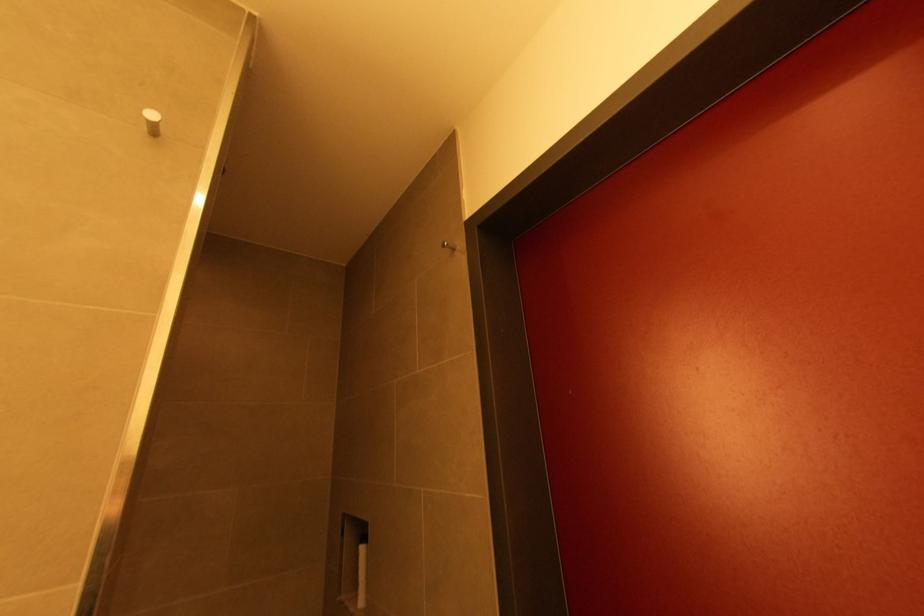
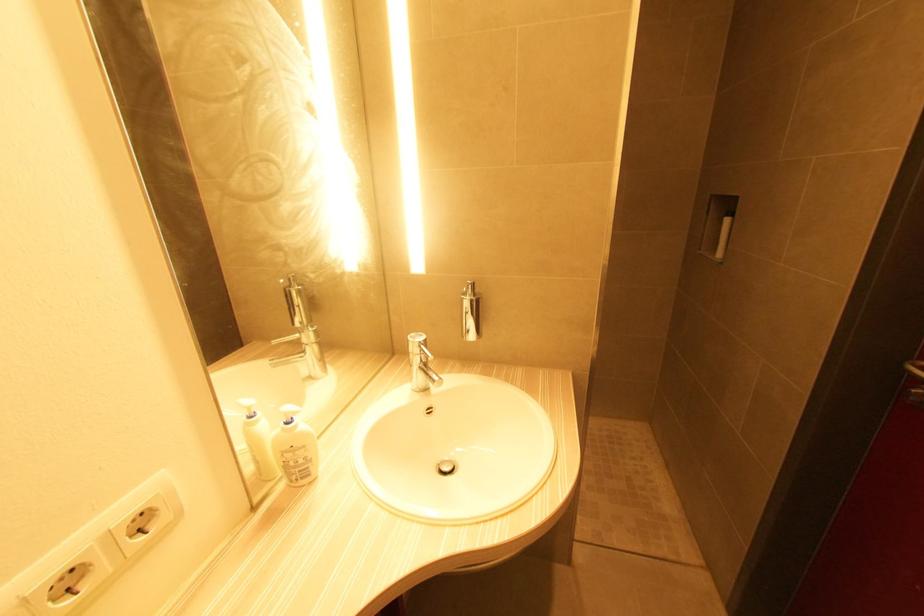
The first image is from the beginning of the video and the second image is from the end. How did the camera likely rotate when shooting the video?

The camera's rotation is toward left-down.